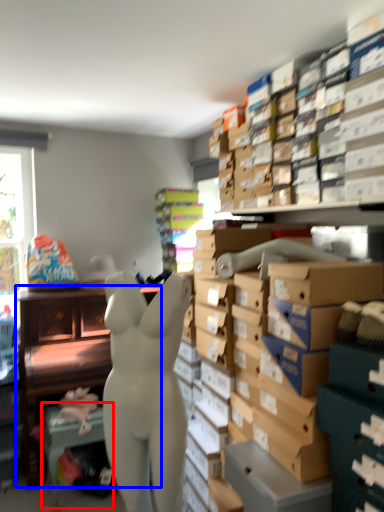
Question: Which of the following is the farthest to the observer, table (highlighted by a red box) or furniture (highlighted by a blue box)?

Choices:
 (A) table
 (B) furniture

Answer: (B)